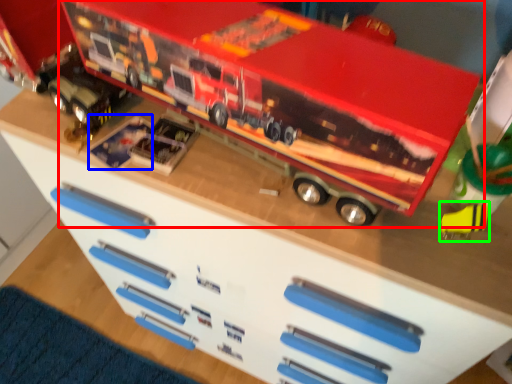
Question: Based on their relative distances, which object is farther from toy (highlighted by a red box)? Choose from toy (highlighted by a blue box) and toy (highlighted by a green box).

Choices:
 (A) toy
 (B) toy

Answer: (B)